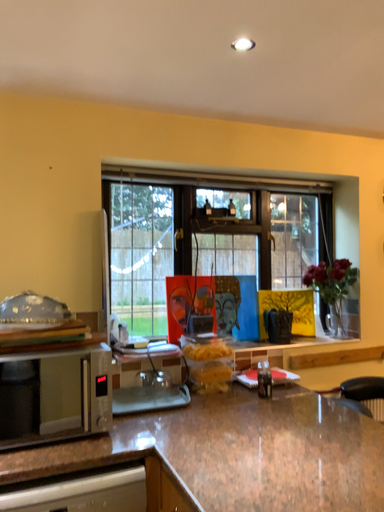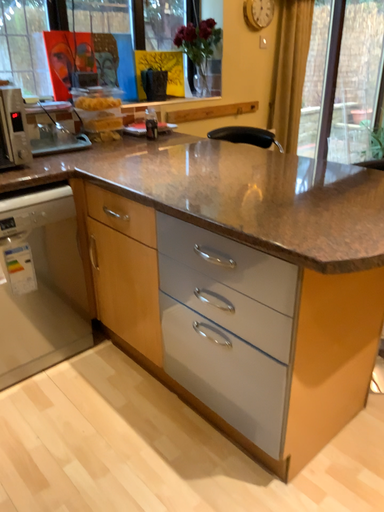
Question: Which way did the camera rotate in the video?

Choices:
 (A) rotated right
 (B) rotated left

Answer: (A)